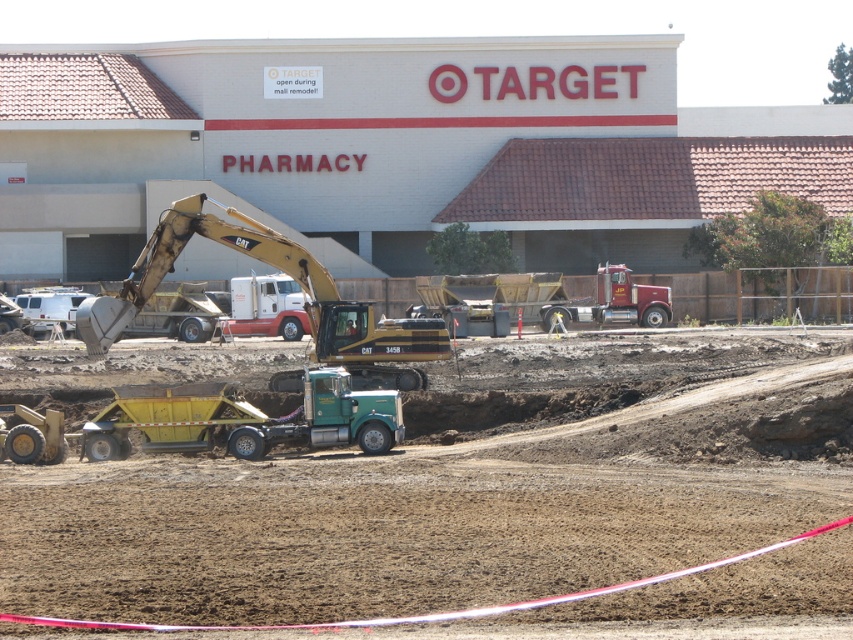
Question: Based on their relative distances, which object is farther from the green metallic trailer truck at center?

Choices:
 (A) green rubber construction worker at center
 (B) yellow metallic excavator at center
 (C) brown sandy dirt at center

Answer: (C)

Question: Can you confirm if yellow metallic excavator at center is positioned to the right of green rubber construction worker at center?

Choices:
 (A) yes
 (B) no

Answer: (B)

Question: Does brown sandy dirt at center have a larger size compared to yellow metallic excavator at center?

Choices:
 (A) no
 (B) yes

Answer: (B)

Question: Which point appears closest to the camera in this image?

Choices:
 (A) (131, 467)
 (B) (109, 403)
 (C) (267, 240)

Answer: (A)

Question: Does brown sandy dirt at center have a lesser width compared to green rubber construction worker at center?

Choices:
 (A) no
 (B) yes

Answer: (A)

Question: Which object is farther from the camera taking this photo?

Choices:
 (A) green metallic trailer truck at center
 (B) brown sandy dirt at center
 (C) yellow metallic excavator at center
 (D) green rubber construction worker at center

Answer: (D)